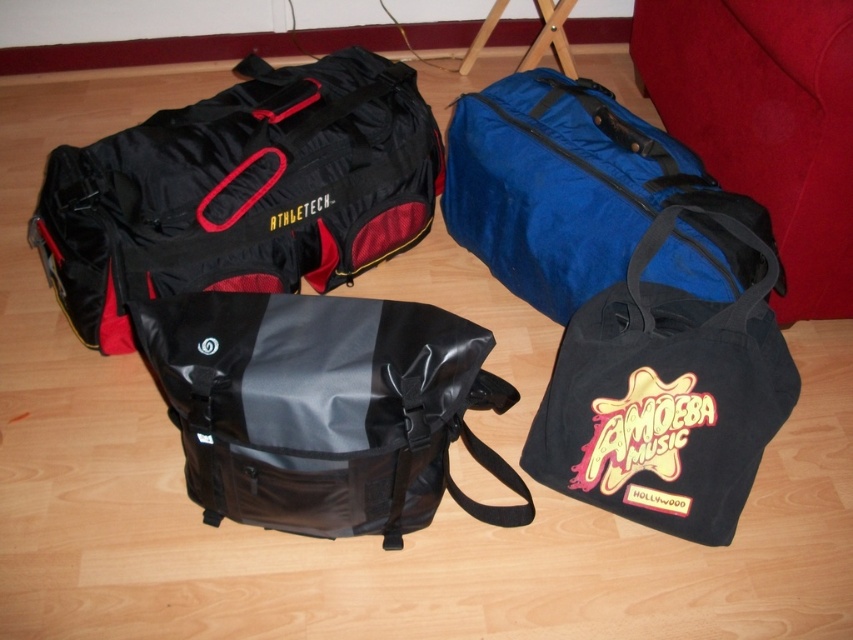
You are organizing a storage closet and need to place the black matte duffel bag at left and the blue fabric duffel at upper right. The minimum distance required between items on the shelf is 14 inches. Can these two bags be placed next to each other without violating the storage rules?

The black matte duffel bag at left is 13.89 inches from blue fabric duffel at upper right, which is less than the required 14 inches. Therefore, they cannot be placed next to each other without violating the storage rules.

You are standing in a room with a blue fabric duffel at upper right and a red fabric couch at upper right. Which object is positioned to the left when facing the upper right corner?

The blue fabric duffel at upper right is positioned to the left of the red fabric couch at upper right.